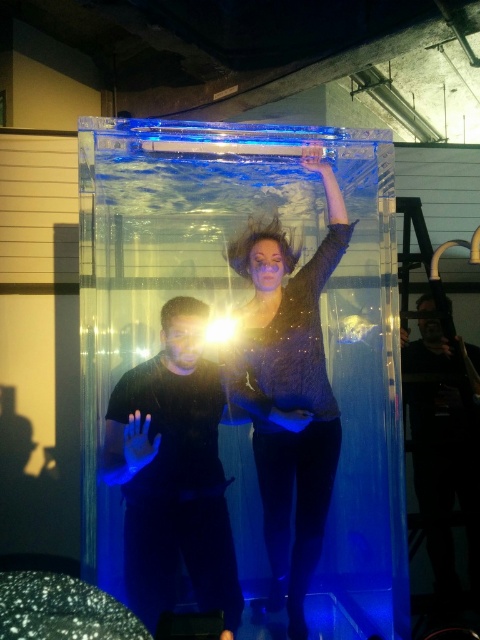
Question: Is matte black dress at center closer to camera compared to dark matte man at center?

Choices:
 (A) yes
 (B) no

Answer: (A)

Question: Among these points, which one is nearest to the camera?

Choices:
 (A) (178, 563)
 (B) (333, 250)

Answer: (B)

Question: Does transparent acrylic tank at center lie in front of matte black shirt at center?

Choices:
 (A) no
 (B) yes

Answer: (B)

Question: Considering the real-world distances, which object is farthest from the transparent acrylic tank at center?

Choices:
 (A) matte black shirt at center
 (B) dark matte man at center

Answer: (B)

Question: Does transparent acrylic tank at center appear under matte black dress at center?

Choices:
 (A) no
 (B) yes

Answer: (A)

Question: Among these points, which one is farthest from the camera?

Choices:
 (A) (355, 595)
 (B) (455, 442)

Answer: (B)